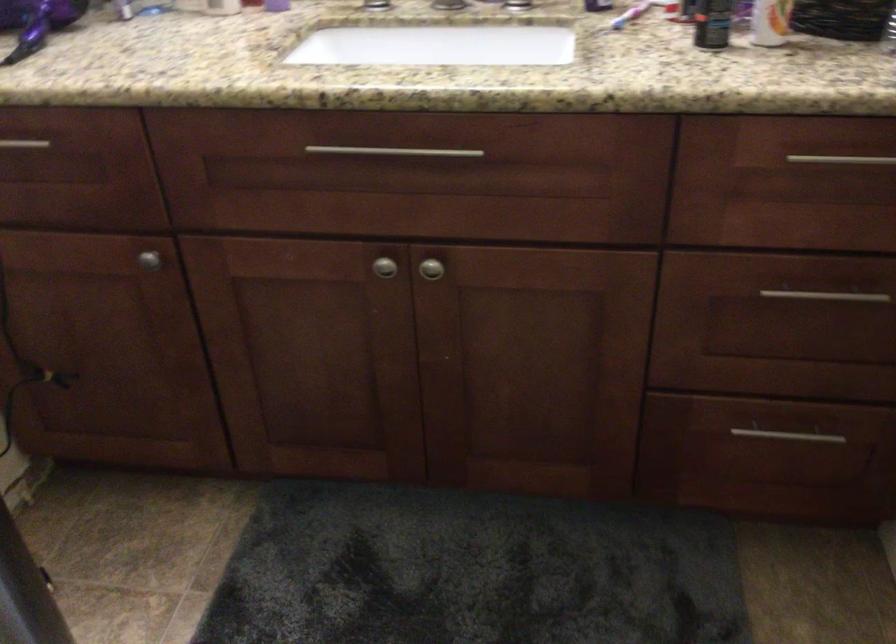
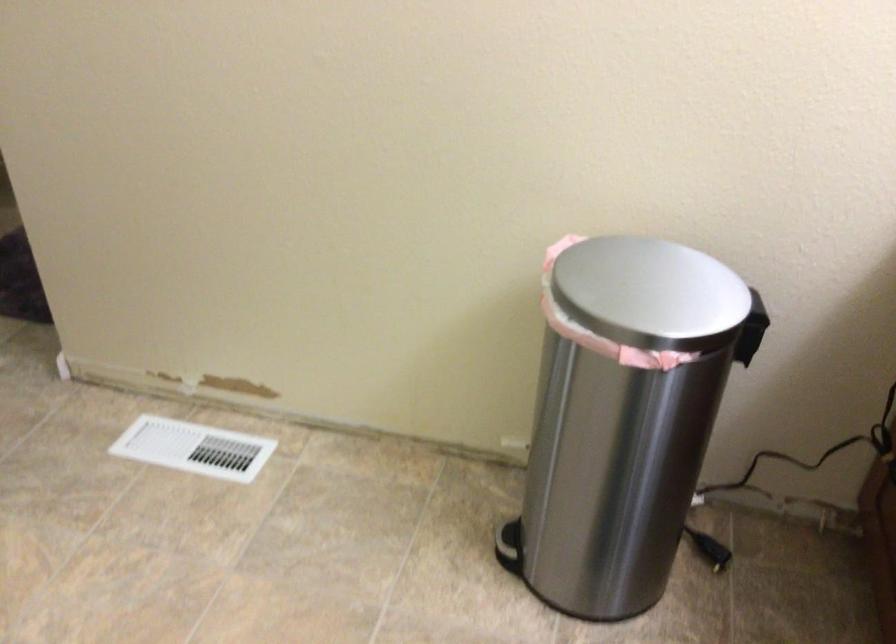
The first image is from the beginning of the video and the second image is from the end. How did the camera likely rotate when shooting the video?

The rotation direction of the camera is left-down.